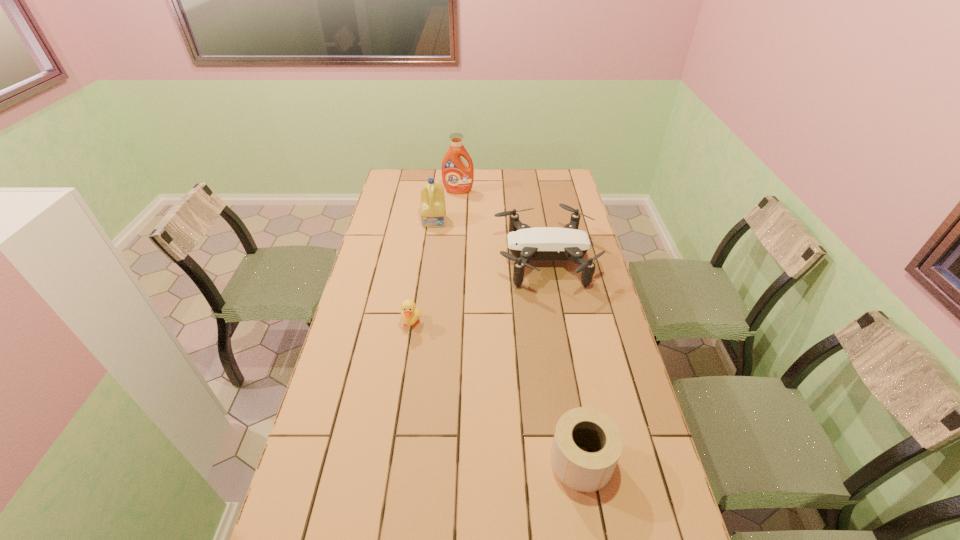
Identify the location of object that is the closest to the second tallest object. This screenshot has width=960, height=540. (457, 177).

Find the location of a particular element. This screenshot has height=540, width=960. vacant space that satisfies the following two spatial constraints: 1. on the camera side of the third nearest object; 2. on the front-facing side of the fourth farthest object is located at coordinates (556, 323).

Find the location of a particular element. vacant space that satisfies the following two spatial constraints: 1. on the camera side of the third farthest object; 2. on the front-facing side of the duckling is located at coordinates (556, 323).

Where is `vacant space that satisfies the following two spatial constraints: 1. on the label of the nearest object; 2. on the left side of the shorter detergent`? The width and height of the screenshot is (960, 540). vacant space that satisfies the following two spatial constraints: 1. on the label of the nearest object; 2. on the left side of the shorter detergent is located at coordinates (403, 461).

Locate an element on the screen. The width and height of the screenshot is (960, 540). vacant space that satisfies the following two spatial constraints: 1. on the front-facing side of the toilet tissue; 2. on the right side of the fourth farthest object is located at coordinates (391, 461).

You are a GUI agent. You are given a task and a screenshot of the screen. Output one action in this format:
    pyautogui.click(x=<x>, y=<y>)
    Task: Click on the vacant point that satisfies the following two spatial constraints: 1. on the camera side of the nearest object; 2. on the left side of the drone
    
    Given the screenshot: What is the action you would take?
    pos(579,461)